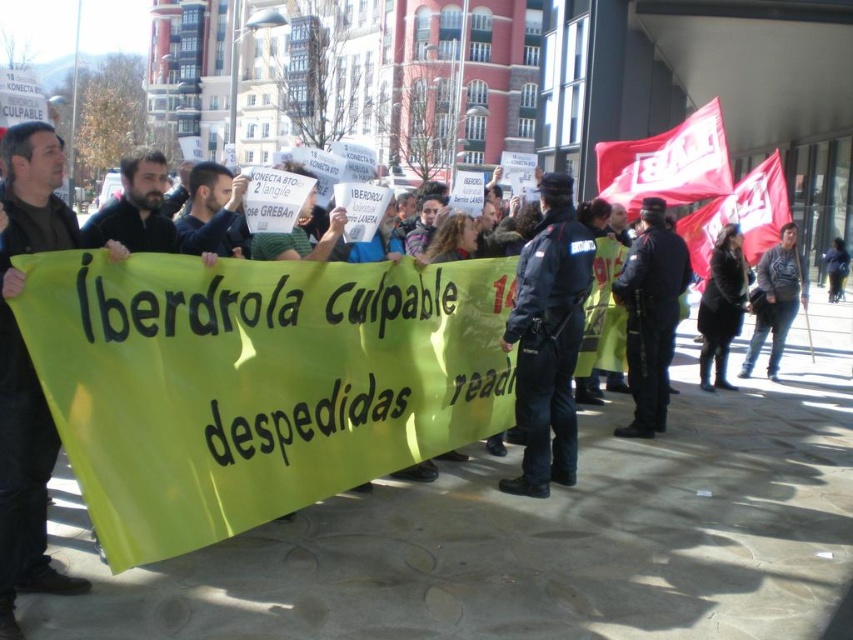
Question: Estimate the real-world distances between objects in this image. Which object is farther from the dark blue uniform at center?

Choices:
 (A) black leather jacket at center
 (B) dark blue jacket at center

Answer: (B)

Question: Which point appears farthest from the camera in this image?

Choices:
 (A) (12, 280)
 (B) (527, 369)
 (C) (833, 296)

Answer: (C)

Question: Is dark blue uniform at center above dark gray sweater at center?

Choices:
 (A) yes
 (B) no

Answer: (B)

Question: Can you confirm if black uniformed officer at center is smaller than dark blue jacket at center?

Choices:
 (A) no
 (B) yes

Answer: (A)

Question: Does black leather jacket at center have a smaller size compared to dark gray sweater at center?

Choices:
 (A) no
 (B) yes

Answer: (A)

Question: Among these objects, which one is nearest to the camera?

Choices:
 (A) dark blue uniform at center
 (B) dark gray sweater at center
 (C) black fabric at left

Answer: (C)